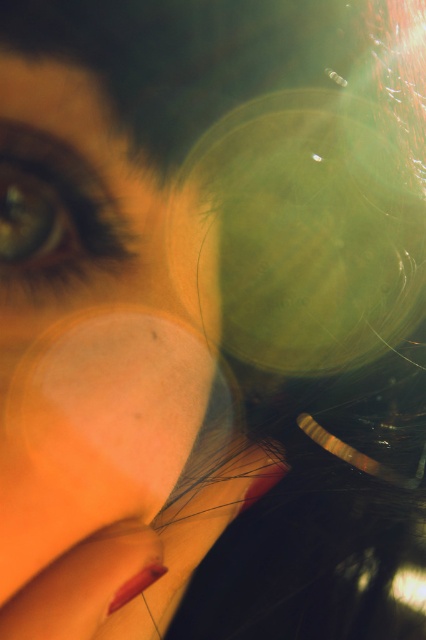
You are a photographer trying to adjust the focus on your camera. You want to ensure that the point at coordinates point (135, 470) is sharp in the image. Given that the camera is currently 10.48 inches away from this point, should you move the camera closer or farther away to achieve better focus?

To achieve better focus on the point (135, 470), you should move the camera closer to the point since it is currently 10.48 inches away, which might be beyond the optimal focusing distance for sharpness.